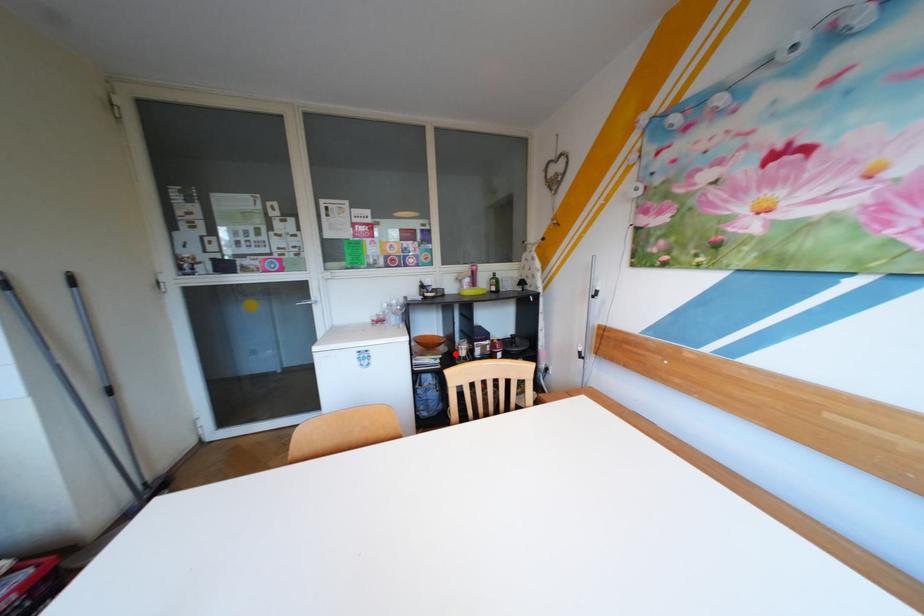
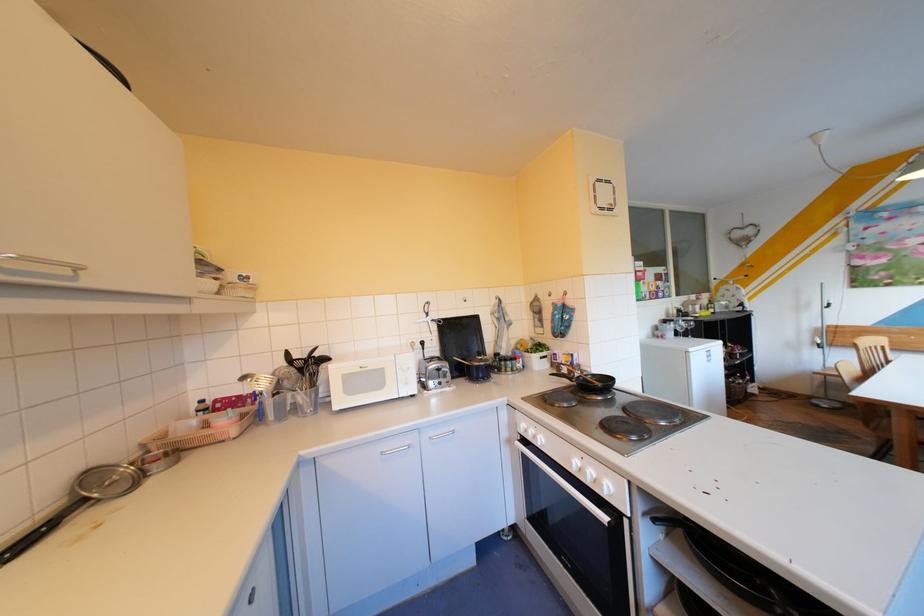
Question: I am providing you with two images of the same scene from different viewpoints. A red point is marked on the first image. Can you still see the location of the red point in image 2?

Choices:
 (A) Yes
 (B) No

Answer: (B)